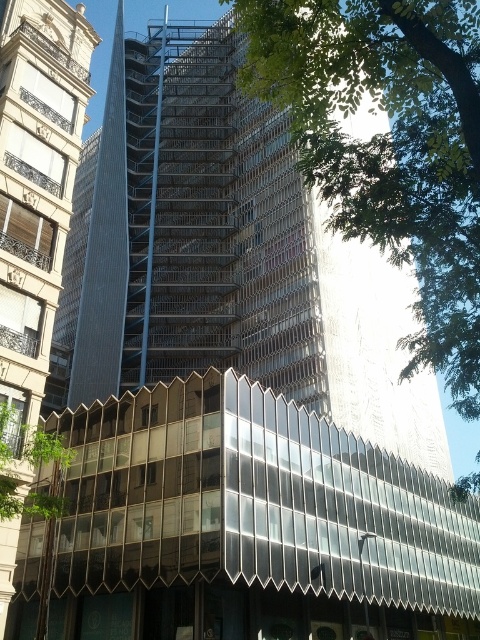
Question: Which point appears farthest from the camera in this image?

Choices:
 (A) (59, 264)
 (B) (418, 312)

Answer: (A)

Question: Observing the image, what is the correct spatial positioning of green leafy tree at upper right in reference to glassy reflective tower at center?

Choices:
 (A) below
 (B) above

Answer: (A)

Question: Which object appears closest to the camera in this image?

Choices:
 (A) glassy reflective tower at center
 (B) green leafy tree at upper right

Answer: (B)

Question: Does green leafy tree at upper right lie behind glassy reflective tower at center?

Choices:
 (A) yes
 (B) no

Answer: (B)

Question: Is green leafy tree at upper right further to the viewer compared to glassy reflective tower at center?

Choices:
 (A) no
 (B) yes

Answer: (A)